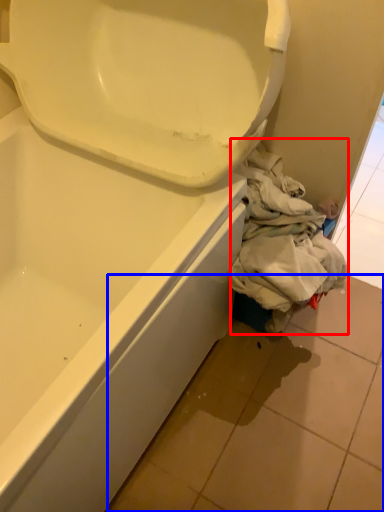
Question: Which point is closer to the camera, clothing (highlighted by a red box) or tile (highlighted by a blue box)?

Choices:
 (A) clothing
 (B) tile

Answer: (B)